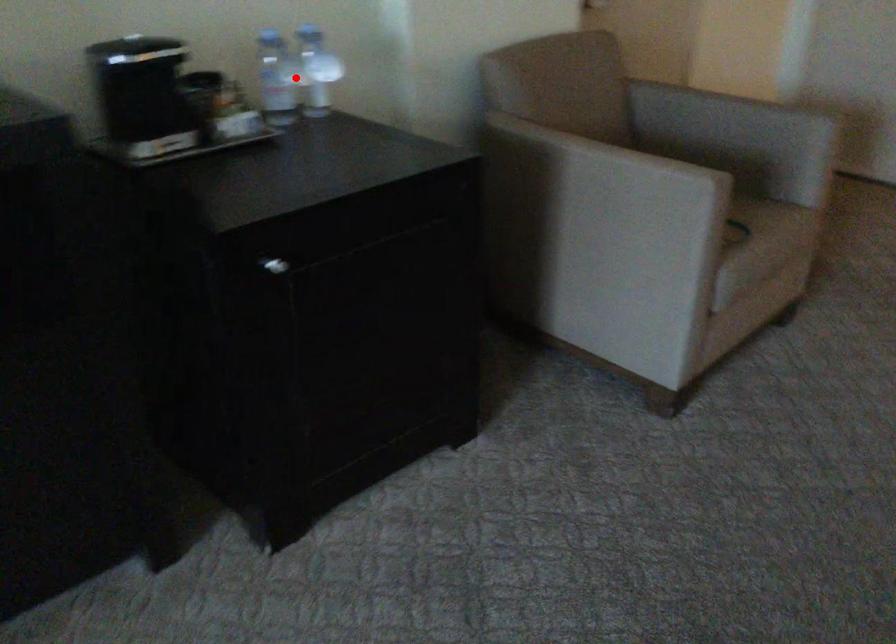
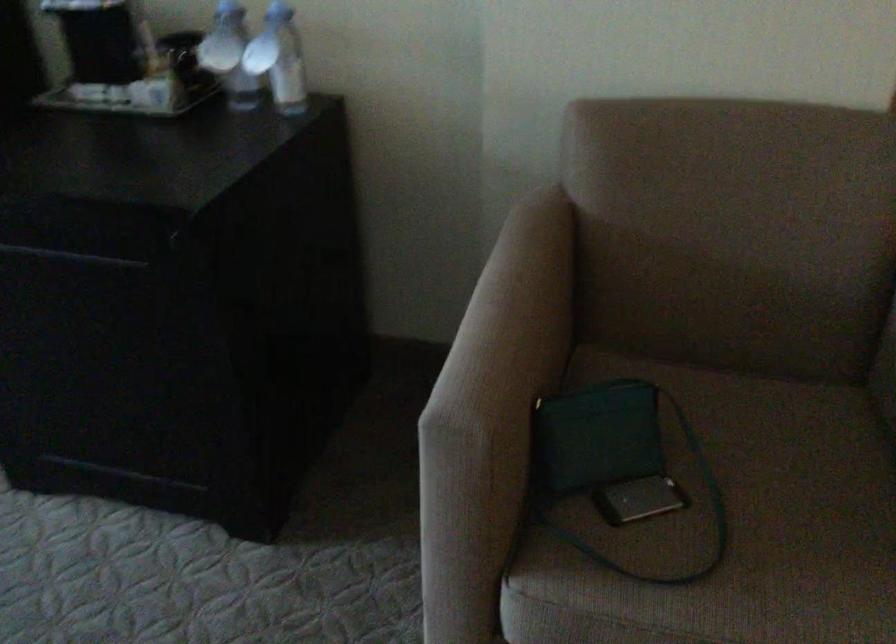
Find the pixel in the second image that matches the highlighted location in the first image.

(229, 55)